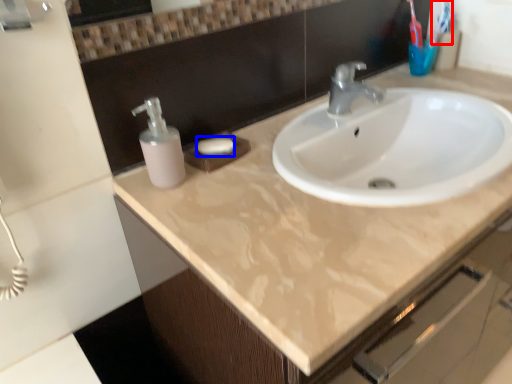
Question: Which object appears farthest to the camera in this image, toothbrush (highlighted by a red box) or soap (highlighted by a blue box)?

Choices:
 (A) toothbrush
 (B) soap

Answer: (A)